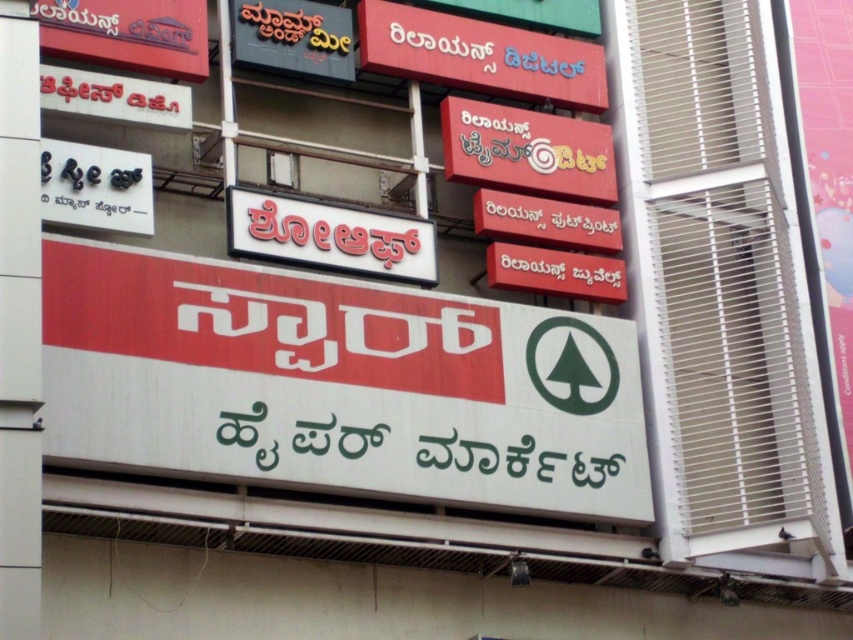
Question: Which point is farther to the camera?

Choices:
 (A) (38, 12)
 (B) (525, 172)
 (C) (90, 83)
 (D) (328, 44)

Answer: (B)

Question: In this image, where is matte red signboard at upper left located relative to white matte signboard at upper left?

Choices:
 (A) right
 (B) left

Answer: (B)

Question: Which of the following is the farthest from the observer?

Choices:
 (A) white plastic signboard at center
 (B) matte red signboard at upper center
 (C) matte black signboard at upper center

Answer: (B)

Question: Is white plastic signboard at center to the right of white glossy signboard at upper left from the viewer's perspective?

Choices:
 (A) yes
 (B) no

Answer: (A)

Question: Estimate the real-world distances between objects in this image. Which object is closer to the white glossy signboard at upper left?

Choices:
 (A) matte red signboard at upper left
 (B) white plastic signboard at center
 (C) matte black signboard at upper center

Answer: (A)

Question: Is matte black signboard at upper center wider than white matte signboard at upper left?

Choices:
 (A) no
 (B) yes

Answer: (A)